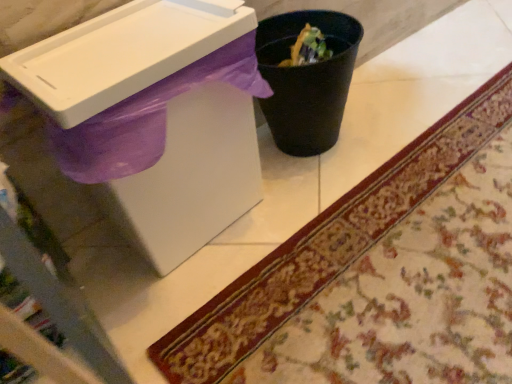
Question: Is carpeted mat at lower right inside or outside of white plastic sink at upper left?

Choices:
 (A) outside
 (B) inside

Answer: (A)

Question: Is carpeted mat at lower right taller or shorter than white plastic sink at upper left?

Choices:
 (A) short
 (B) tall

Answer: (A)

Question: Estimate the real-world distances between objects in this image. Which object is closer to the carpeted mat at lower right?

Choices:
 (A) black plastic trash can at center
 (B) white plastic sink at upper left

Answer: (A)

Question: Which is nearer to the carpeted mat at lower right?

Choices:
 (A) black plastic trash can at center
 (B) white plastic sink at upper left

Answer: (A)